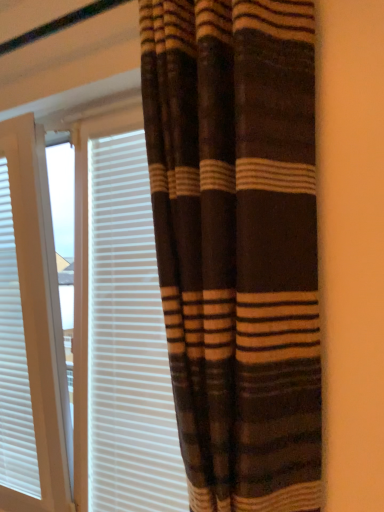
Question: Is white textured blinds at center bigger or smaller than brown striped curtain at center?

Choices:
 (A) big
 (B) small

Answer: (B)

Question: From a real-world perspective, is white textured blinds at center physically located above or below brown striped curtain at center?

Choices:
 (A) above
 (B) below

Answer: (B)

Question: Which is nearer to the white textured blinds at left?

Choices:
 (A) white textured blinds at center
 (B) brown striped curtain at center

Answer: (A)

Question: Which object is positioned closest to the white textured blinds at left?

Choices:
 (A) white textured blinds at center
 (B) brown striped curtain at center

Answer: (A)